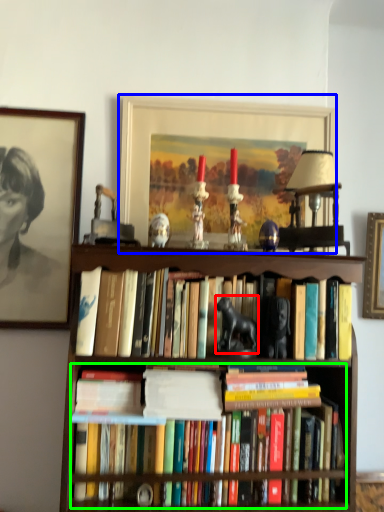
Question: Considering the real-world distances, which object is closest to animal (highlighted by a red box)? picture frame (highlighted by a blue box) or book (highlighted by a green box).

Choices:
 (A) picture frame
 (B) book

Answer: (B)